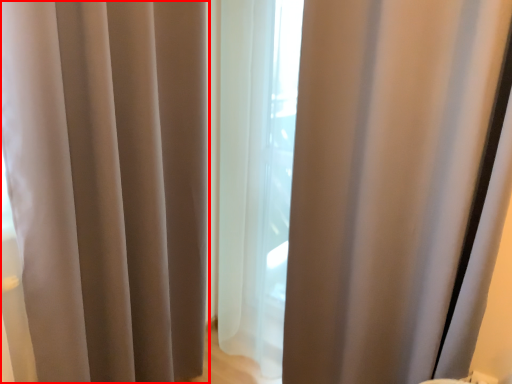
Question: Observing the image, what is the correct spatial positioning of curtain (annotated by the red box) in reference to curtain?

Choices:
 (A) left
 (B) right

Answer: (A)